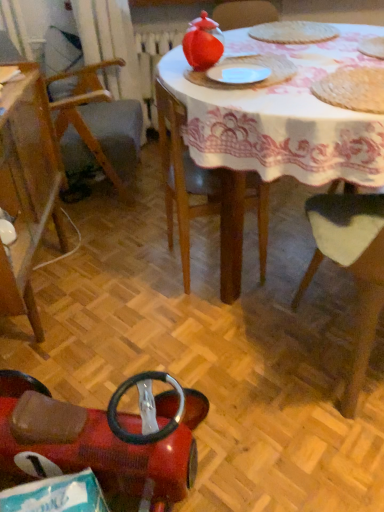
Question: Is rubberized red toy car at lower left, the second chair viewed from the left, in front of or behind white lace tablecloth at upper center in the image?

Choices:
 (A) front
 (B) behind

Answer: (A)

Question: From the image's perspective, is rubberized red toy car at lower left, the 2th chair positioned from the right, above or below white lace tablecloth at upper center?

Choices:
 (A) above
 (B) below

Answer: (B)

Question: Based on their relative distances, which object is farther from the matte glass tea pot at upper center?

Choices:
 (A) wooden chair at left, the first chair when ordered from left to right
 (B) wooden chair at lower right, the 1th chair positioned from the right
 (C) rubberized red toy car at lower left, the second chair viewed from the left
 (D) woven mat at upper right, which is the 1th food from front to back
 (E) white lace tablecloth at upper center

Answer: (C)

Question: Estimate the real-world distances between objects in this image. Which object is farther from the white textured placemat at upper center, the first food when ordered from back to front?

Choices:
 (A) white matte paper plate at center
 (B) matte glass tea pot at upper center
 (C) wooden chair at lower right, the 3th chair in the left-to-right sequence
 (D) rubberized red toy car at lower left, the second chair viewed from the left
 (E) woven mat at upper right, the first food when ordered from bottom to top

Answer: (D)